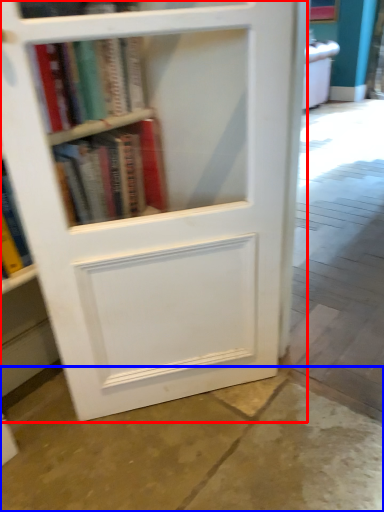
Question: Which object is closer to the camera taking this photo, bookcase (highlighted by a red box) or concrete (highlighted by a blue box)?

Choices:
 (A) bookcase
 (B) concrete

Answer: (B)